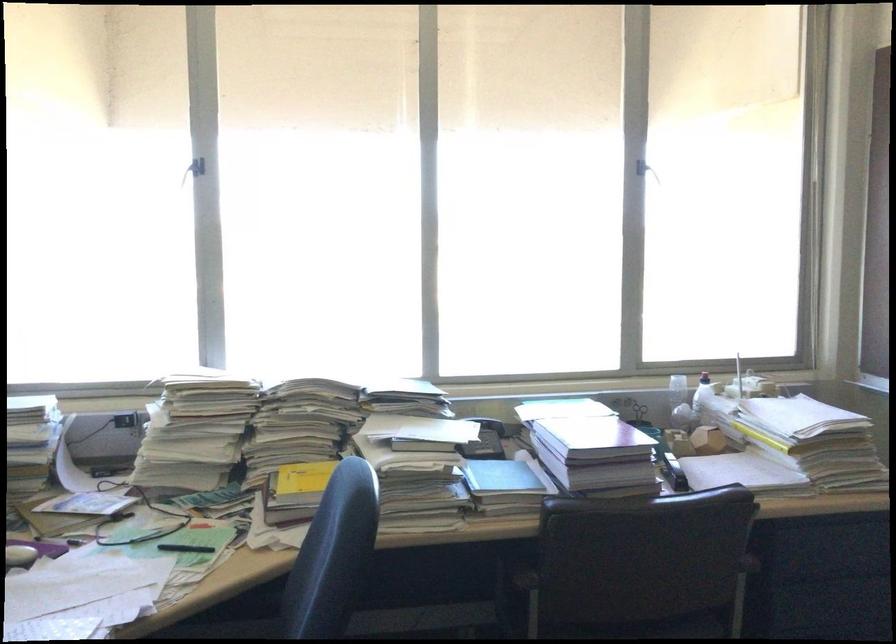
The height and width of the screenshot is (644, 896). Describe the element at coordinates (485, 440) in the screenshot. I see `the telephone handset` at that location.